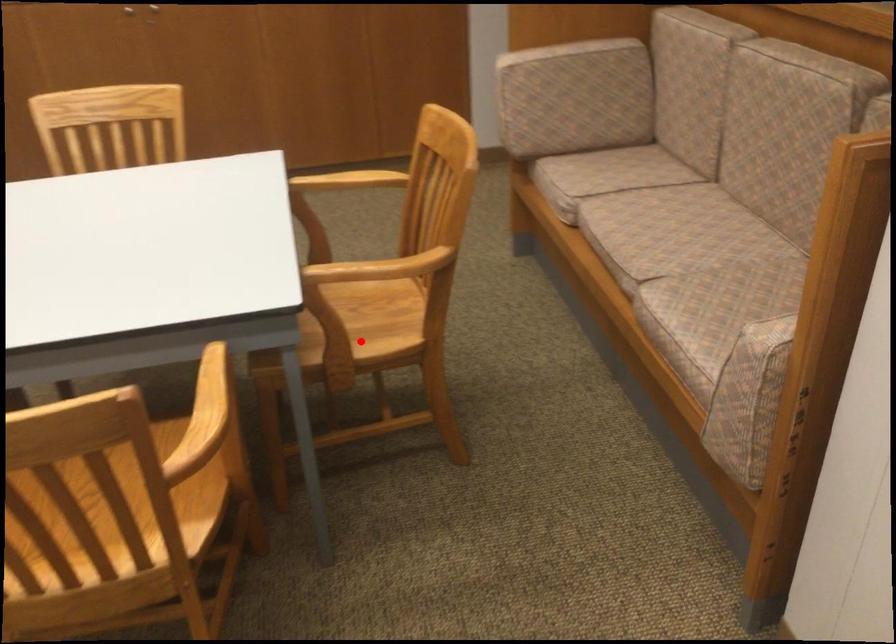
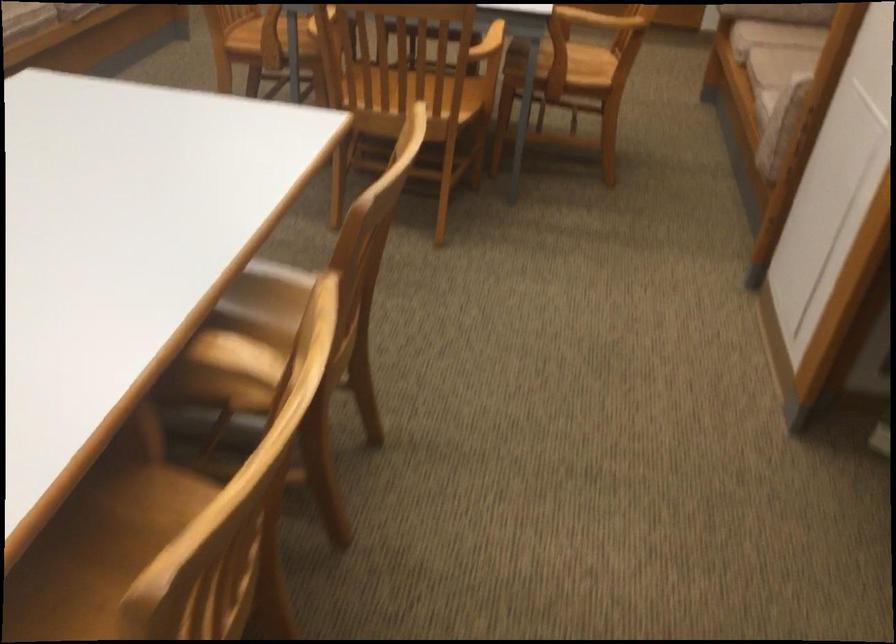
In the second image, find the point that corresponds to the highlighted location in the first image.

(570, 69)